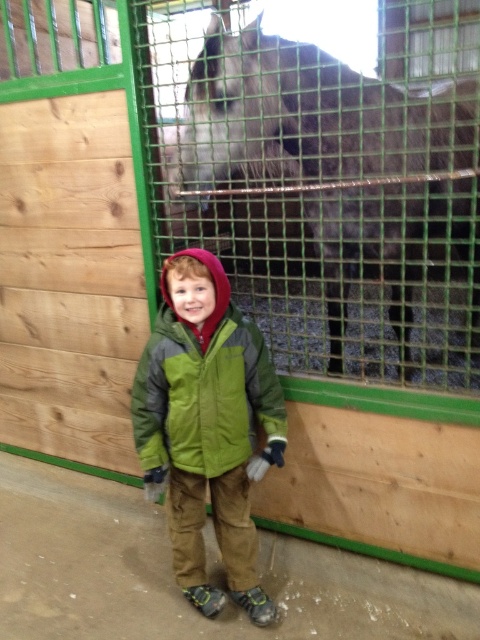
You are a parent trying to ensure your child stays safe while visiting the stable. Based on the image, which item is positioned higher up, the dark brown fur at upper center or the green fleece jacket at center?

The dark brown fur at upper center is located above the green fleece jacket at center, so it is positioned higher up.

You are a parent trying to ensure your child stays safe while visiting the stable. The child is standing near a horse with dark brown fur at upper center. If the recommended safe distance between the child and the horse is 2 meters, is the child currently within a safe distance?

The dark brown fur at upper center is 1.81 meters away from the viewer, which is less than the recommended 2 meters. Therefore, the child is too close to the horse and needs to move back to maintain a safe distance.